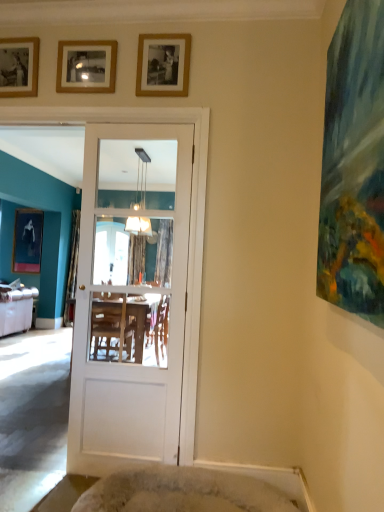
Question: Considering the relative sizes of wooden picture frame at upper center, acting as the third picture frame starting from the back, and white glossy door at center in the image provided, is wooden picture frame at upper center, acting as the third picture frame starting from the back, shorter than white glossy door at center?

Choices:
 (A) no
 (B) yes

Answer: (B)

Question: Can you confirm if wooden picture frame at upper center, the second picture frame in the front-to-back sequence, is thinner than white glossy door at center?

Choices:
 (A) no
 (B) yes

Answer: (B)

Question: From the image's perspective, would you say wooden picture frame at upper center, the third picture frame when ordered from left to right, is shown under white glossy door at center?

Choices:
 (A) no
 (B) yes

Answer: (A)

Question: Is wooden picture frame at upper center, the third picture frame when ordered from left to right, oriented away from white glossy door at center?

Choices:
 (A) yes
 (B) no

Answer: (B)

Question: Considering the relative sizes of wooden picture frame at upper center, the third picture frame when ordered from left to right, and white glossy door at center in the image provided, is wooden picture frame at upper center, the third picture frame when ordered from left to right, bigger than white glossy door at center?

Choices:
 (A) yes
 (B) no

Answer: (B)

Question: Is wooden picture frame at upper center, the second picture frame in the front-to-back sequence, touching white glossy door at center?

Choices:
 (A) yes
 (B) no

Answer: (B)

Question: Considering the relative sizes of gold-framed photo at upper center, the fourth picture frame when ordered from left to right, and wooden photo frame at upper left, the 3th picture frame from the front, in the image provided, is gold-framed photo at upper center, the fourth picture frame when ordered from left to right, smaller than wooden photo frame at upper left, the 3th picture frame from the front,?

Choices:
 (A) yes
 (B) no

Answer: (A)

Question: Can you confirm if gold-framed photo at upper center, the fourth picture frame when ordered from left to right, is wider than wooden photo frame at upper left, the 2th picture frame in the back-to-front sequence?

Choices:
 (A) no
 (B) yes

Answer: (A)

Question: Is gold-framed photo at upper center, the fourth picture frame when ordered from left to right, at the right side of wooden photo frame at upper left, which is the second picture frame in left-to-right order?

Choices:
 (A) yes
 (B) no

Answer: (A)

Question: From the image's perspective, does gold-framed photo at upper center, the fourth picture frame when ordered from left to right, appear lower than wooden photo frame at upper left, the 2th picture frame in the back-to-front sequence?

Choices:
 (A) no
 (B) yes

Answer: (B)

Question: Is gold-framed photo at upper center, the fourth picture frame in the back-to-front sequence, positioned in front of wooden photo frame at upper left, the 3th picture frame from the front?

Choices:
 (A) no
 (B) yes

Answer: (B)

Question: Is gold-framed photo at upper center, the fourth picture frame when ordered from left to right, looking in the opposite direction of wooden photo frame at upper left, arranged as the third picture frame when viewed from the right?

Choices:
 (A) yes
 (B) no

Answer: (B)

Question: Is gold-framed photo at upper center, the fourth picture frame when ordered from left to right, facing towards white glossy door at center?

Choices:
 (A) yes
 (B) no

Answer: (B)